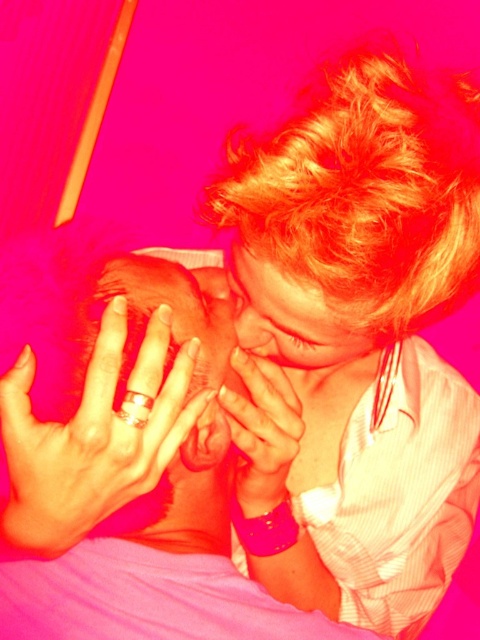
Looking at this image, can you confirm if smooth skin face at center is positioned to the right of smooth skin nose at center?

Indeed, smooth skin face at center is positioned on the right side of smooth skin nose at center.

Who is shorter, smooth skin face at center or smooth skin nose at center?

smooth skin nose at center is shorter.

Find the location of `smooth skin face at center`. smooth skin face at center is located at coordinates (296, 320).

Can you confirm if smooth skin baby at center is wider than smooth skin nose at center?

Yes.

Can you confirm if smooth skin baby at center is shorter than smooth skin nose at center?

No.

Which is in front, point (195, 282) or point (245, 332)?

Point (245, 332) is in front.

Identify the location of smooth skin baby at center. The image size is (480, 640). (170, 316).

Can you confirm if smooth skin baby at center is positioned above smooth skin face at center?

No, smooth skin baby at center is not above smooth skin face at center.

Between smooth skin baby at center and smooth skin face at center, which one is positioned lower?

Positioned lower is smooth skin baby at center.

Find the location of a particular element. The width and height of the screenshot is (480, 640). smooth skin baby at center is located at coordinates click(x=170, y=316).

Identify the location of smooth skin baby at center. (170, 316).